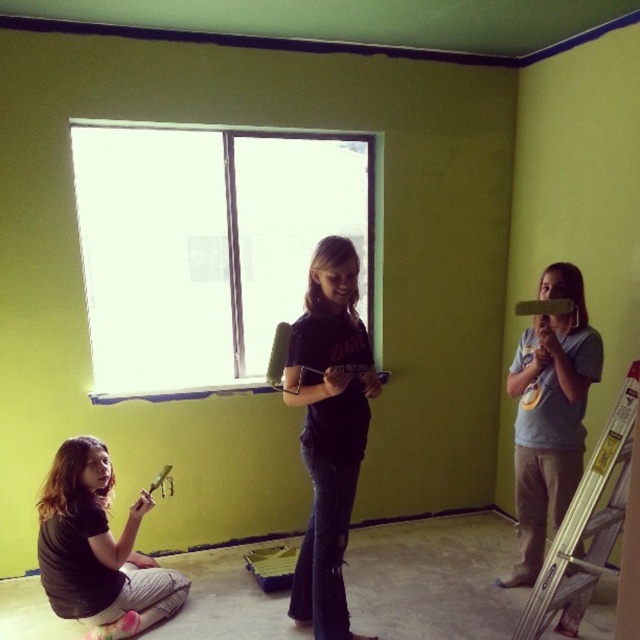
Which is behind, point (321, 637) or point (593, 452)?

Point (321, 637)

Who is positioned more to the left, black matte shirt at center or silver metallic ladder at right?

black matte shirt at center is more to the left.

Between point (296, 605) and point (616, 429), which one is positioned in front?

Point (616, 429) is in front.

In order to click on black matte shirt at center in this screenshot , I will do `click(330, 429)`.

Can you confirm if matte gray shirt at upper right is shorter than matte green paintbrush at lower left?

No, matte gray shirt at upper right is not shorter than matte green paintbrush at lower left.

Does point (566, 420) come closer to viewer compared to point (154, 488)?

Yes, point (566, 420) is in front of point (154, 488).

Locate an element on the screen. matte gray shirt at upper right is located at coordinates (548, 416).

Is matte gray shirt at upper right closer to camera compared to matte black shirt at lower left?

No, matte gray shirt at upper right is behind matte black shirt at lower left.

Is point (541, 433) closer to camera compared to point (72, 544)?

No, it is behind (72, 544).

Between point (584, 408) and point (80, 593), which one is positioned in front?

Positioned in front is point (80, 593).

At what (x,y) coordinates should I click in order to perform the action: click on matte gray shirt at upper right. Please return your answer as a coordinate pair (x, y). This screenshot has height=640, width=640. Looking at the image, I should click on (548, 416).